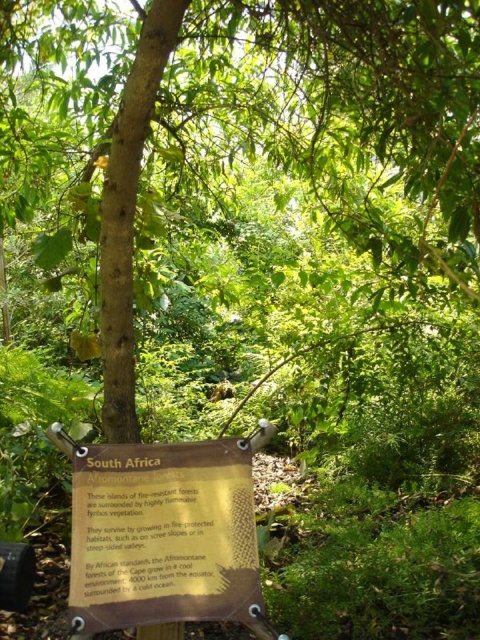
Based on the photo, you are a park ranger measuring the width of the brown rough bark tree at center and the gold textured sign at center. Which object has a greater width?

The brown rough bark tree at center is wider than the gold textured sign at center according to the description.

You are a park ranger who needs to place a new fire extinguisher between the brown rough bark tree at center and the gold textured sign at center. The extinguisher requires 1 meter of space around it. Is there enough space between the two objects to place it?

The brown rough bark tree at center and gold textured sign at center are 1.29 meters apart from each other. Since the fire extinguisher requires 1 meter of space around it, the total required space would be 2 meters. However, the distance between them is only 1.29 meters, so there is not enough space to place the extinguisher between them.

You are a hiker who wants to take a photo of the gold textured sign at center without the brown rough bark tree at center blocking the view. Is it possible to position yourself in such a way that the sign is fully visible while the tree is not in the frame?

The brown rough bark tree at center is taller than the gold textured sign at center, so if you position yourself at a lower angle or move to a spot where the tree is behind you or out of the camera frame, you can capture the sign without the tree obstructing the view.